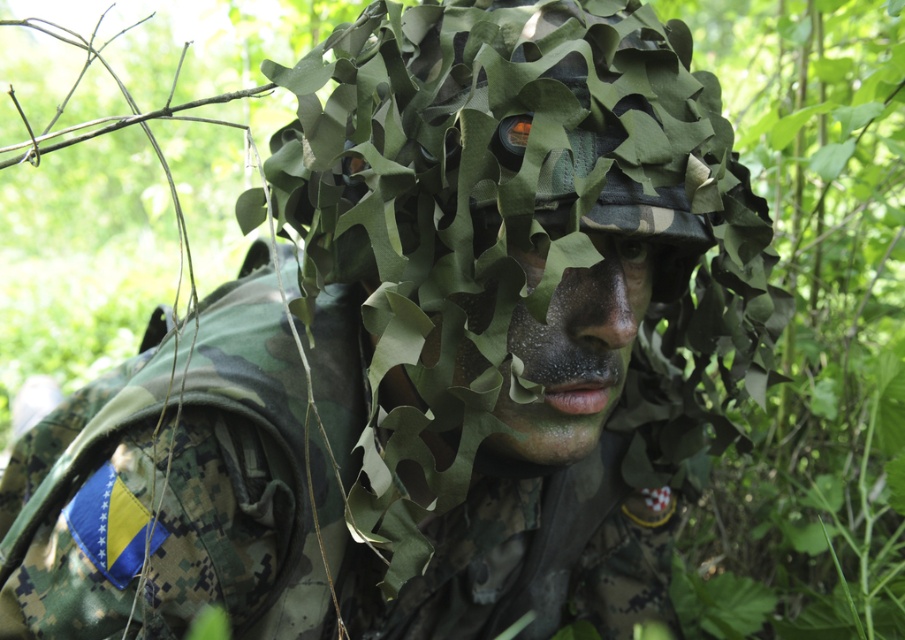
Is point (741, 324) positioned behind point (615, 312)?

Yes.

Between green leafy netting at center and camouflage netting at center, which one appears on the left side from the viewer's perspective?

From the viewer's perspective, green leafy netting at center appears more on the left side.

Is point (692, 444) in front of point (602, 314)?

No, (692, 444) is further to viewer.

Locate an element on the screen. The image size is (905, 640). green leafy netting at center is located at coordinates (524, 234).